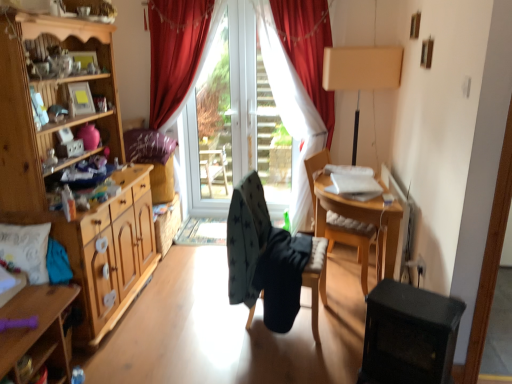
Question: Is point (373, 84) closer or farther from the camera than point (357, 236)?

Choices:
 (A) farther
 (B) closer

Answer: (A)

Question: Would you say beige fabric lampshade at upper right is inside or outside wooden chair at right, marked as the second chair in a left-to-right arrangement?

Choices:
 (A) outside
 (B) inside

Answer: (A)

Question: Which object is the closest to the dark gray fabric chair at center, acting as the 2th chair starting from the right?

Choices:
 (A) wooden desk at lower left
 (B) white textured pillow at left, the first pillow when ordered from front to back
 (C) wooden chair at right, marked as the second chair in a left-to-right arrangement
 (D) wooden cabinet at left
 (E) red velvet curtain at center

Answer: (C)

Question: Based on their relative distances, which object is nearer to the wooden chair at right, which ranks as the first chair in right-to-left order?

Choices:
 (A) beige fabric lampshade at upper right
 (B) transparent glass door at center
 (C) wooden desk at lower left
 (D) dark gray fabric chair at center, which is the 1th chair in left-to-right order
 (E) wooden cabinet at left

Answer: (D)